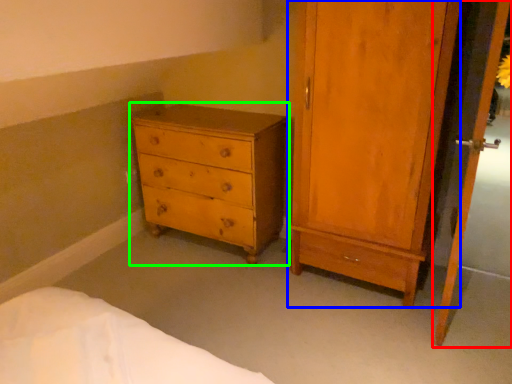
Question: Which object is the farthest from screen door (highlighted by a red box)? Choose among these: door (highlighted by a blue box) or chest of drawers (highlighted by a green box).

Choices:
 (A) door
 (B) chest of drawers

Answer: (B)